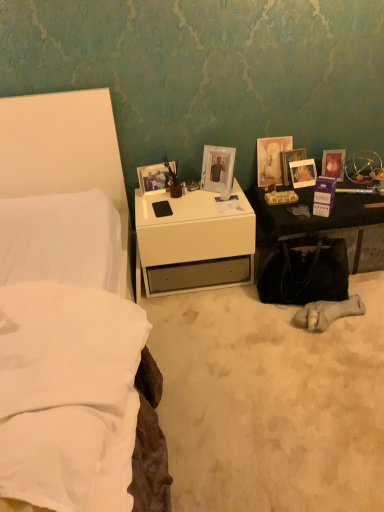
Where is `white glossy nightstand at lower left`? Image resolution: width=384 pixels, height=512 pixels. white glossy nightstand at lower left is located at coordinates (195, 242).

Identify the location of matte glass picture frame at upper right, which is the fourth picture frame from right to left. This screenshot has height=512, width=384. (271, 159).

Where is `white fabric bed at upper left`? white fabric bed at upper left is located at coordinates (65, 153).

The image size is (384, 512). Describe the element at coordinates (65, 153) in the screenshot. I see `white fabric bed at upper left` at that location.

The height and width of the screenshot is (512, 384). Identify the location of matte plastic picture frame at center right, the 5th picture frame when ordered from left to right. (303, 173).

Where is `black glossy nightstand at right`? The height and width of the screenshot is (512, 384). black glossy nightstand at right is located at coordinates (324, 226).

What do you see at coordinates (324, 226) in the screenshot? The image size is (384, 512). I see `black glossy nightstand at right` at bounding box center [324, 226].

The height and width of the screenshot is (512, 384). What are the coordinates of `black leather handbag at lower right` in the screenshot? It's located at (305, 272).

The image size is (384, 512). I want to click on matte glass photo frame at upper right, placed as the 4th picture frame when sorted from left to right, so click(x=289, y=162).

Could you tell me if white glossy picture frame at center, the second picture frame in the left-to-right sequence, is turned towards black glossy nightstand at right?

No, white glossy picture frame at center, the second picture frame in the left-to-right sequence, is not facing towards black glossy nightstand at right.

Considering the sizes of white glossy picture frame at center, the second picture frame in the left-to-right sequence, and black glossy nightstand at right in the image, is white glossy picture frame at center, the second picture frame in the left-to-right sequence, taller or shorter than black glossy nightstand at right?

Considering their sizes, white glossy picture frame at center, the second picture frame in the left-to-right sequence, has more height than black glossy nightstand at right.

Are white glossy picture frame at center, the second picture frame in the left-to-right sequence, and black glossy nightstand at right far apart?

No.

Considering the sizes of objects black glossy nightstand at right and white soft pillow at left in the image provided, who is thinner, black glossy nightstand at right or white soft pillow at left?

Thinner between the two is white soft pillow at left.

From a real-world perspective, which is physically below, black glossy nightstand at right or white soft pillow at left?

black glossy nightstand at right, from a real-world perspective.

Between black glossy nightstand at right and white soft pillow at left, which one is positioned behind?

black glossy nightstand at right is further from the camera.

Is matte glass photo frame at upper right, placed as the 4th picture frame when sorted from left to right, inside white glossy picture frame at center, positioned as the 5th picture frame in right-to-left order?

No, matte glass photo frame at upper right, placed as the 4th picture frame when sorted from left to right, is not a part of white glossy picture frame at center, positioned as the 5th picture frame in right-to-left order.

Is white glossy picture frame at center, the second picture frame in the left-to-right sequence, taller than matte glass photo frame at upper right, placed as the 4th picture frame when sorted from left to right?

Yes.

Is white glossy picture frame at center, positioned as the 5th picture frame in right-to-left order, far away from matte glass photo frame at upper right, the third picture frame from the right?

Actually, white glossy picture frame at center, positioned as the 5th picture frame in right-to-left order, and matte glass photo frame at upper right, the third picture frame from the right, are a little close together.

Which point is more forward, [221,157] or [284,177]?

The point [221,157] is more forward.

Are matte glass picture frame at right, which appears as the 1th picture frame when viewed from the right, and white glossy picture frame at center, the second picture frame in the left-to-right sequence, far apart?

No, matte glass picture frame at right, which appears as the 1th picture frame when viewed from the right, is not far away from white glossy picture frame at center, the second picture frame in the left-to-right sequence.

From a real-world perspective, is matte glass picture frame at right, which appears as the 1th picture frame when viewed from the right, located higher than white glossy picture frame at center, positioned as the 5th picture frame in right-to-left order?

Actually, matte glass picture frame at right, which appears as the 1th picture frame when viewed from the right, is physically below white glossy picture frame at center, positioned as the 5th picture frame in right-to-left order, in the real world.

Find the location of `the 4th picture frame to the left of the matte glass picture frame at right, which appears as the 1th picture frame when viewed from the right, starting your count from the anchor`. the 4th picture frame to the left of the matte glass picture frame at right, which appears as the 1th picture frame when viewed from the right, starting your count from the anchor is located at coordinates (218, 170).

Between point (342, 162) and point (229, 174), which one is positioned behind?

Positioned behind is point (342, 162).

Image resolution: width=384 pixels, height=512 pixels. I want to click on picture frame behind the matte glass picture frame at right, the 6th picture frame positioned from the left, so click(x=289, y=162).

Does matte glass photo frame at upper right, placed as the 4th picture frame when sorted from left to right, have a smaller size compared to matte glass picture frame at right, which appears as the 1th picture frame when viewed from the right?

Yes, matte glass photo frame at upper right, placed as the 4th picture frame when sorted from left to right, is smaller than matte glass picture frame at right, which appears as the 1th picture frame when viewed from the right.

Is matte glass photo frame at upper right, placed as the 4th picture frame when sorted from left to right, positioned before matte glass picture frame at right, the 6th picture frame positioned from the left?

No, matte glass photo frame at upper right, placed as the 4th picture frame when sorted from left to right, is further to the viewer.

From a real-world perspective, is matte glass photo frame at upper right, the third picture frame from the right, positioned above or below matte glass picture frame at right, which appears as the 1th picture frame when viewed from the right?

Clearly, from a real-world perspective, matte glass photo frame at upper right, the third picture frame from the right, is above matte glass picture frame at right, which appears as the 1th picture frame when viewed from the right.

Would you say matte glass photo frame at upper right, the third picture frame from the right, is part of matte glass picture frame at upper right, which is the fourth picture frame from right to left,'s contents?

Yes, matte glass picture frame at upper right, which is the fourth picture frame from right to left, is surrounding matte glass photo frame at upper right, the third picture frame from the right.

Considering the relative positions of matte glass picture frame at upper right, which is the third picture frame from left to right, and matte glass photo frame at upper right, placed as the 4th picture frame when sorted from left to right, in the image provided, is matte glass picture frame at upper right, which is the third picture frame from left to right, to the left or to the right of matte glass photo frame at upper right, placed as the 4th picture frame when sorted from left to right,?

In the image, matte glass picture frame at upper right, which is the third picture frame from left to right, appears on the left side of matte glass photo frame at upper right, placed as the 4th picture frame when sorted from left to right.

Consider the image. Is matte glass picture frame at upper right, which is the fourth picture frame from right to left, next to matte glass photo frame at upper right, placed as the 4th picture frame when sorted from left to right?

Yes, matte glass picture frame at upper right, which is the fourth picture frame from right to left, is right next to matte glass photo frame at upper right, placed as the 4th picture frame when sorted from left to right, and making contact.

Considering the relative sizes of matte glass picture frame at upper right, which is the third picture frame from left to right, and matte glass photo frame at upper right, the third picture frame from the right, in the image provided, is matte glass picture frame at upper right, which is the third picture frame from left to right, thinner than matte glass photo frame at upper right, the third picture frame from the right,?

In fact, matte glass picture frame at upper right, which is the third picture frame from left to right, might be wider than matte glass photo frame at upper right, the third picture frame from the right.

Can we say white soft pillow at left lies outside black glossy nightstand at right?

Indeed, white soft pillow at left is completely outside black glossy nightstand at right.

I want to click on nightstand below the white soft pillow at left (from a real-world perspective), so click(x=324, y=226).

Are white soft pillow at left and black glossy nightstand at right making contact?

white soft pillow at left and black glossy nightstand at right are clearly separated.

Is white soft pillow at left oriented away from black glossy nightstand at right?

No, white soft pillow at left is not facing away from black glossy nightstand at right.

Identify the location of the 4th picture frame counting from the left side of the black glossy nightstand at right. tap(218, 170).

At what (x,y) coordinates should I click in order to perform the action: click on nightstand below the white soft pillow at left (from a real-world perspective). Please return your answer as a coordinate pair (x, y). Image resolution: width=384 pixels, height=512 pixels. Looking at the image, I should click on (324, 226).

Looking at the image, which one is located closer to black leather handbag at lower right, matte glass photo frame at upper right, the third picture frame from the right, or white glossy picture frame at center, positioned as the 5th picture frame in right-to-left order?

The object closer to black leather handbag at lower right is white glossy picture frame at center, positioned as the 5th picture frame in right-to-left order.

From the image, which object appears to be nearer to matte plastic picture frame at center right, the 5th picture frame when ordered from left to right, white soft pillow at left or white fabric bed at upper left?

white fabric bed at upper left is closer to matte plastic picture frame at center right, the 5th picture frame when ordered from left to right.

From the image, which object appears to be nearer to matte glass picture frame at right, which appears as the 1th picture frame when viewed from the right, white glossy picture frame at center, the second picture frame in the left-to-right sequence, or black leather handbag at lower right?

The object closer to matte glass picture frame at right, which appears as the 1th picture frame when viewed from the right, is black leather handbag at lower right.

Based on their spatial positions, is matte wooden picture frame at upper center, the 6th picture frame when ordered from right to left, or black leather handbag at lower right closer to matte plastic picture frame at center right, the 2th picture frame when ordered from right to left?

black leather handbag at lower right lies closer to matte plastic picture frame at center right, the 2th picture frame when ordered from right to left, than the other object.

From the image, which object appears to be farther from white soft pillow at left, white fabric bed at upper left or white glossy picture frame at center, the second picture frame in the left-to-right sequence?

white glossy picture frame at center, the second picture frame in the left-to-right sequence, is positioned further to the anchor white soft pillow at left.

When comparing their distances from matte wooden picture frame at upper center, the 6th picture frame when ordered from right to left, does black glossy nightstand at right or matte glass photo frame at upper right, placed as the 4th picture frame when sorted from left to right, seem closer?

matte glass photo frame at upper right, placed as the 4th picture frame when sorted from left to right, is positioned closer to the anchor matte wooden picture frame at upper center, the 6th picture frame when ordered from right to left.

When comparing their distances from black leather handbag at lower right, does white fabric bed at upper left or matte plastic picture frame at center right, the 2th picture frame when ordered from right to left, seem further?

The object further to black leather handbag at lower right is white fabric bed at upper left.

Which object lies nearer to the anchor point white fabric bed at upper left, matte glass picture frame at right, which appears as the 1th picture frame when viewed from the right, or matte wooden picture frame at upper center, the 6th picture frame when ordered from right to left?

matte wooden picture frame at upper center, the 6th picture frame when ordered from right to left, is positioned closer to the anchor white fabric bed at upper left.

Locate an element on the screen. The height and width of the screenshot is (512, 384). handbag located between white glossy picture frame at center, the second picture frame in the left-to-right sequence, and black glossy nightstand at right in the left-right direction is located at coordinates (305, 272).

The height and width of the screenshot is (512, 384). Identify the location of desk between white fabric bed at upper left and white glossy picture frame at center, the second picture frame in the left-to-right sequence, in the front-back direction. coord(195,242).

Image resolution: width=384 pixels, height=512 pixels. Find the location of `pillow between white fabric bed at upper left and matte glass photo frame at upper right, the third picture frame from the right, from front to back`. pillow between white fabric bed at upper left and matte glass photo frame at upper right, the third picture frame from the right, from front to back is located at coordinates (67, 347).

The width and height of the screenshot is (384, 512). In order to click on nightstand located between white fabric bed at upper left and matte glass picture frame at right, the 6th picture frame positioned from the left, in the depth direction in this screenshot , I will do `click(324, 226)`.